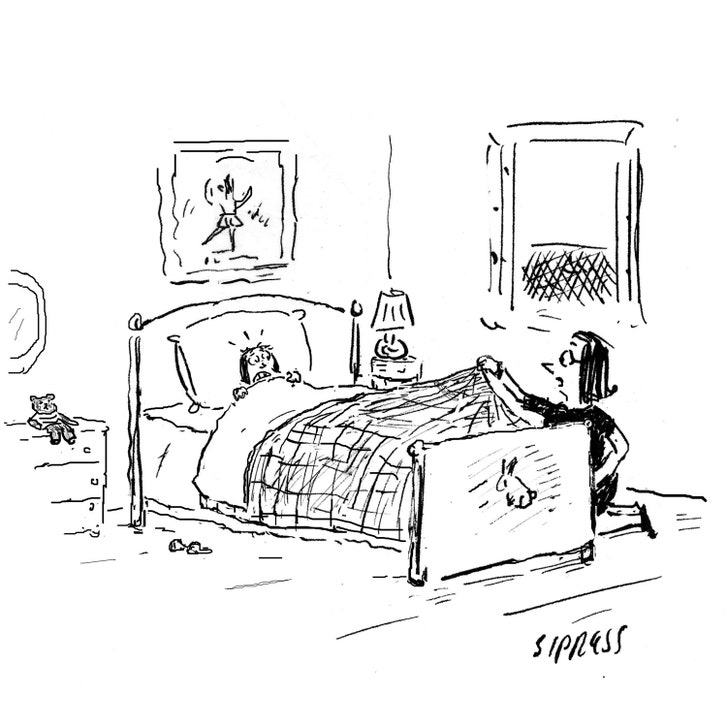
Find the location of a particular element. This screenshot has width=727, height=727. lamp is located at coordinates (395, 325).